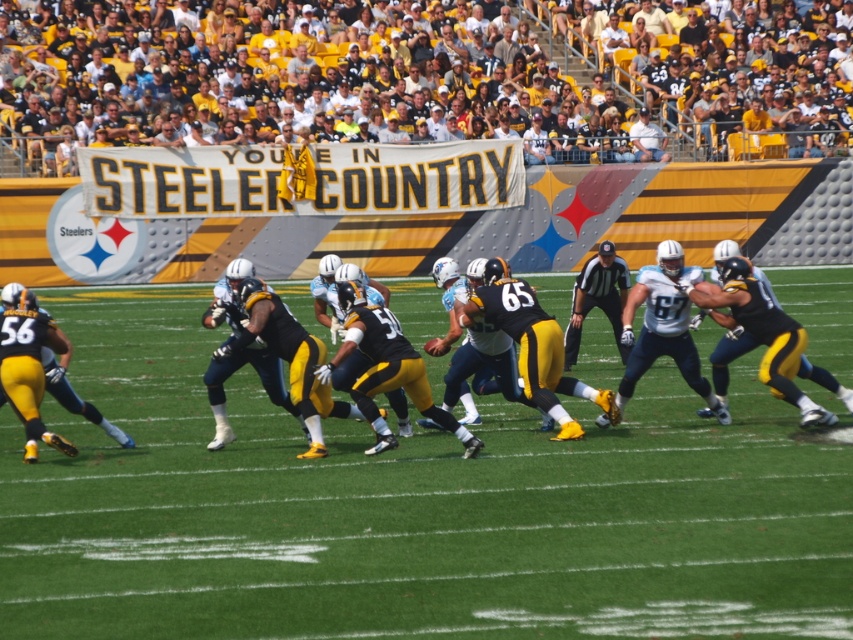
Question: Can you confirm if green grass at center is positioned to the left of black matte jersey at center?

Choices:
 (A) yes
 (B) no

Answer: (A)

Question: Is green grass at center positioned behind black matte jersey at center?

Choices:
 (A) yes
 (B) no

Answer: (B)

Question: Is green grass at center to the right of black matte jersey at center from the viewer's perspective?

Choices:
 (A) yes
 (B) no

Answer: (B)

Question: Which object appears closest to the camera in this image?

Choices:
 (A) green grass at center
 (B) black matte jersey at center

Answer: (A)